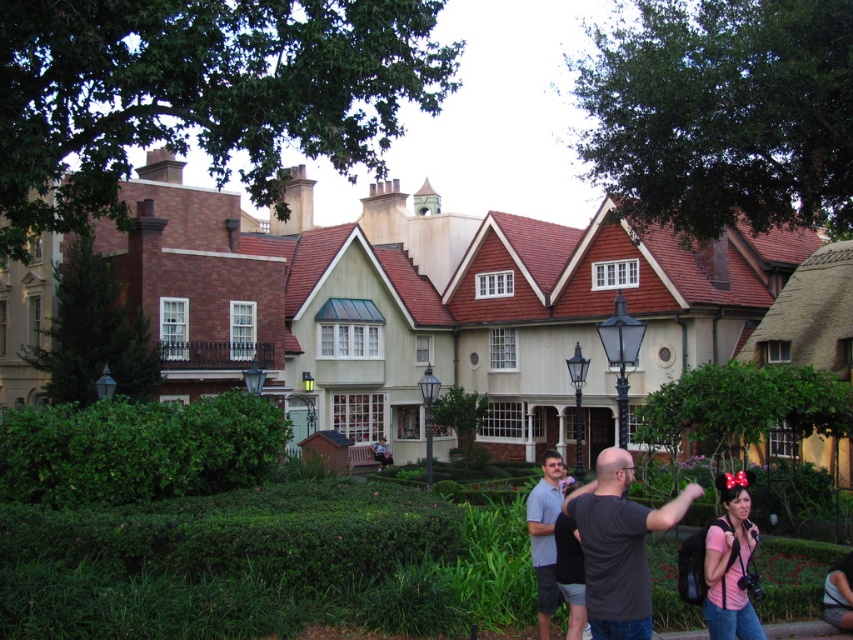
Can you confirm if pink fabric at lower right is bigger than gray cotton shirt at center?

No, pink fabric at lower right is not bigger than gray cotton shirt at center.

Is pink fabric at lower right wider than gray cotton shirt at center?

Incorrect, pink fabric at lower right's width does not surpass gray cotton shirt at center's.

Identify the location of pink fabric at lower right. Image resolution: width=853 pixels, height=640 pixels. (730, 563).

Which of these two, dark gray t-shirt at center or gray cotton shirt at center, stands taller?

With more height is gray cotton shirt at center.

Does dark gray t-shirt at center have a greater height compared to gray cotton shirt at center?

In fact, dark gray t-shirt at center may be shorter than gray cotton shirt at center.

Who is more distant from viewer, (601, 586) or (538, 490)?

Point (538, 490)

You are a GUI agent. You are given a task and a screenshot of the screen. Output one action in this format:
    pyautogui.click(x=<x>, y=<y>)
    Task: Click on the dark gray t-shirt at center
    
    Given the screenshot: What is the action you would take?
    pyautogui.click(x=619, y=545)

Does green leafy hedge at center have a smaller size compared to dark gray t-shirt at center?

Yes, green leafy hedge at center is smaller than dark gray t-shirt at center.

Locate an element on the screen. Image resolution: width=853 pixels, height=640 pixels. green leafy hedge at center is located at coordinates (138, 449).